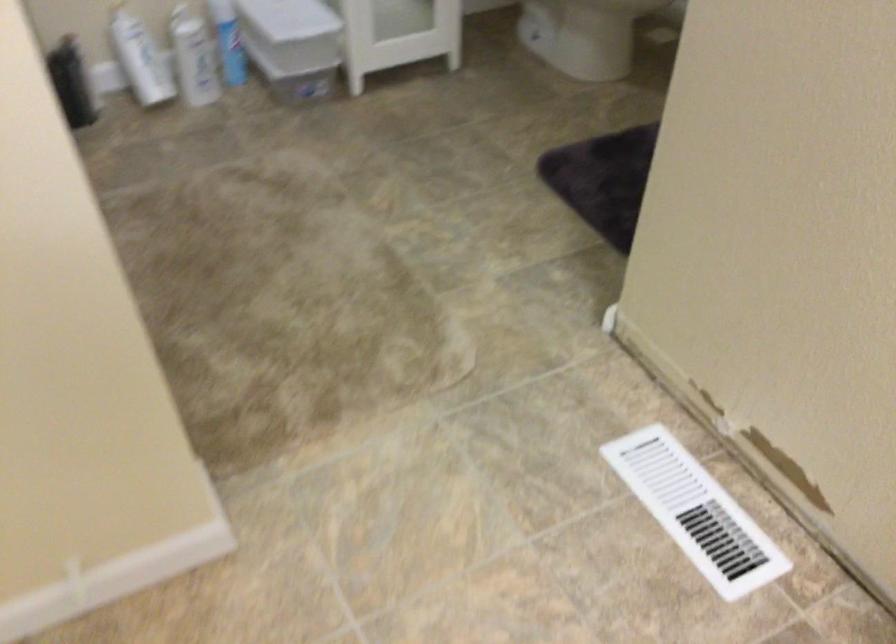
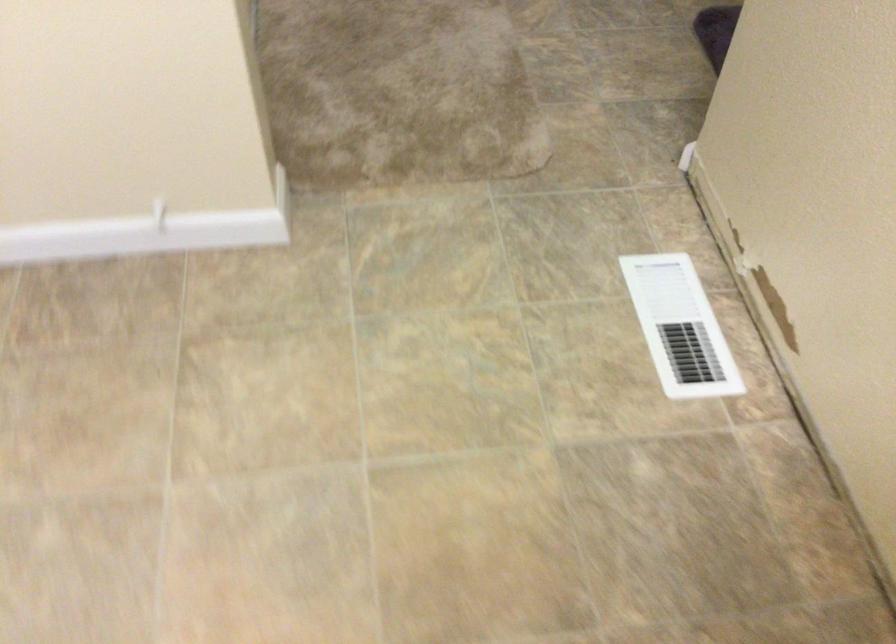
Where in the second image is the point corresponding to the point at 694,512 from the first image?

(679, 327)